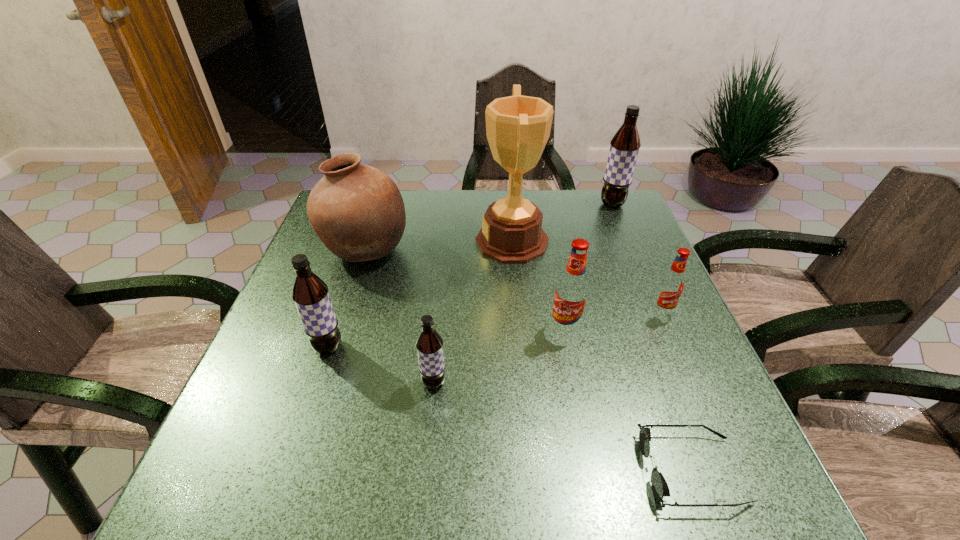
This screenshot has width=960, height=540. I want to click on award, so click(518, 127).

Find the location of `the farthest root beer`. the farthest root beer is located at coordinates (624, 147).

Identify the location of the tallest root beer. (624, 147).

In order to click on pottery in this screenshot , I will do `click(357, 211)`.

Locate an element on the screen. the third root beer from right to left is located at coordinates (572, 289).

This screenshot has width=960, height=540. Find the location of `the bigger red root beer`. the bigger red root beer is located at coordinates (572, 289).

Find the location of a particular element. This screenshot has width=960, height=540. the second biggest brown root beer is located at coordinates (310, 294).

Identify the location of the leftmost brown root beer. This screenshot has width=960, height=540. (310, 294).

Locate an element on the screen. the right red root beer is located at coordinates (670, 288).

This screenshot has height=540, width=960. Find the location of `the smallest brown root beer`. the smallest brown root beer is located at coordinates (429, 343).